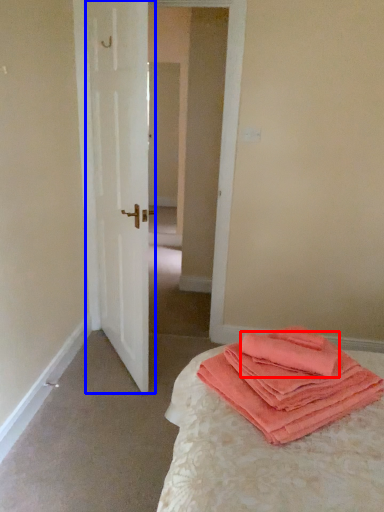
Question: Which object is closer to the camera taking this photo, cloth (highlighted by a red box) or door (highlighted by a blue box)?

Choices:
 (A) cloth
 (B) door

Answer: (A)